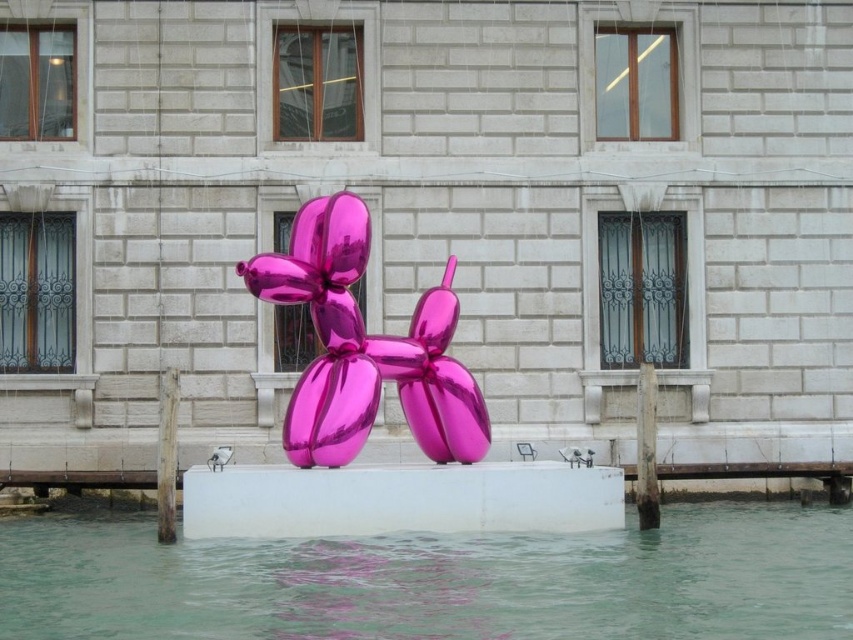
Question: In this image, where is transparent water at center located relative to metallic pink balloon at center?

Choices:
 (A) below
 (B) above

Answer: (A)

Question: Among these objects, which one is farthest from the camera?

Choices:
 (A) metallic pink balloon at center
 (B) transparent water at center

Answer: (A)

Question: Which of the following is the closest to the observer?

Choices:
 (A) (346, 580)
 (B) (357, 330)

Answer: (A)

Question: Is transparent water at center above metallic pink balloon at center?

Choices:
 (A) no
 (B) yes

Answer: (A)

Question: Is transparent water at center bigger than metallic pink balloon at center?

Choices:
 (A) no
 (B) yes

Answer: (B)